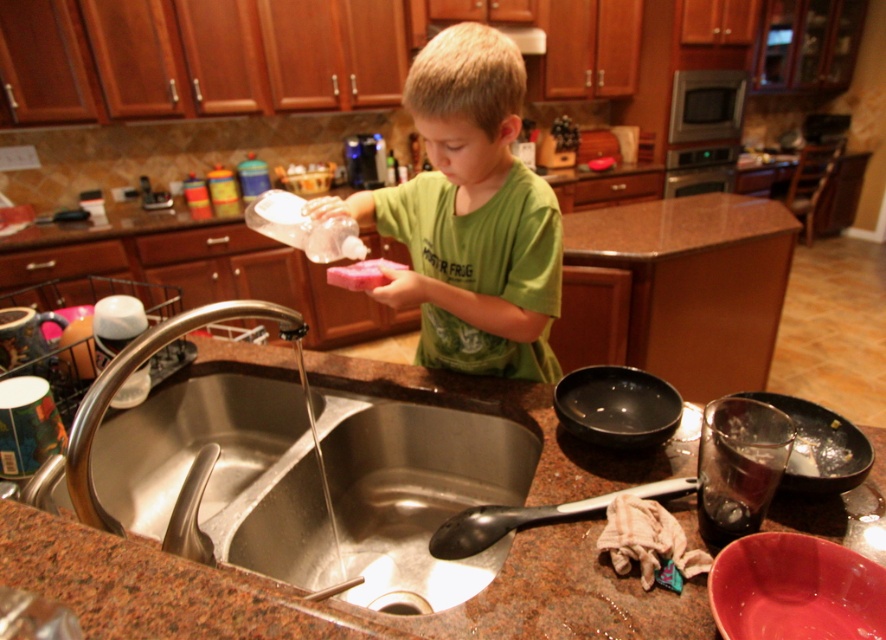
Does green matte shirt at center appear on the right side of brushed metal faucet at sink left?

Correct, you'll find green matte shirt at center to the right of brushed metal faucet at sink left.

Which is more to the left, green matte shirt at center or brushed metal faucet at sink left?

brushed metal faucet at sink left is more to the left.

Locate an element on the screen. green matte shirt at center is located at coordinates (470, 216).

This screenshot has width=886, height=640. Describe the element at coordinates (417, 488) in the screenshot. I see `stainless steel sink at lower left` at that location.

I want to click on stainless steel sink at lower left, so click(417, 488).

This screenshot has height=640, width=886. I want to click on stainless steel sink at lower left, so click(x=417, y=488).

Does stainless steel sink at lower left have a greater height compared to green matte shirt at center?

No.

Can you confirm if stainless steel sink at lower left is positioned to the right of green matte shirt at center?

No, stainless steel sink at lower left is not to the right of green matte shirt at center.

Does point (418, 484) come behind point (457, 120)?

Yes, point (418, 484) is farther from viewer.

Where is `stainless steel sink at lower left`? This screenshot has height=640, width=886. stainless steel sink at lower left is located at coordinates (417, 488).